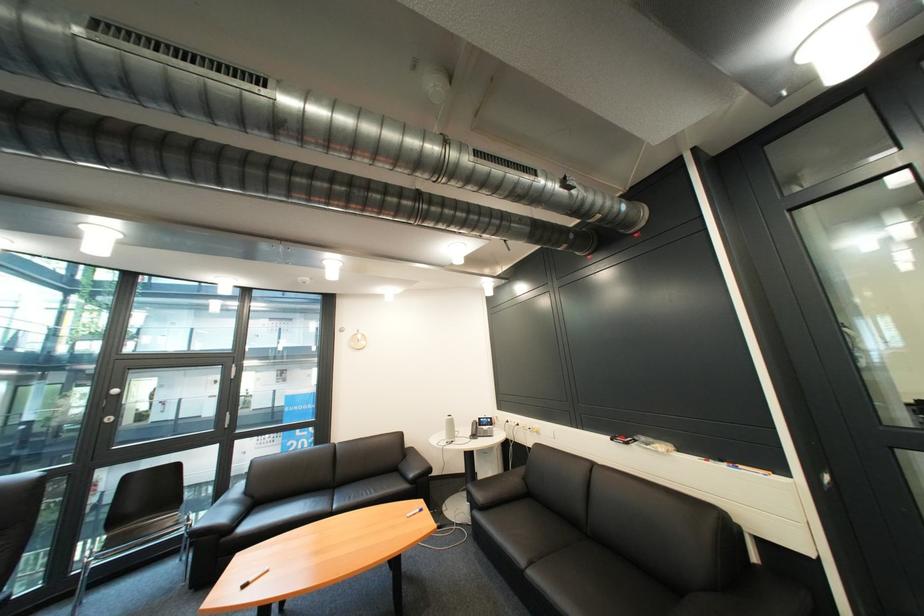
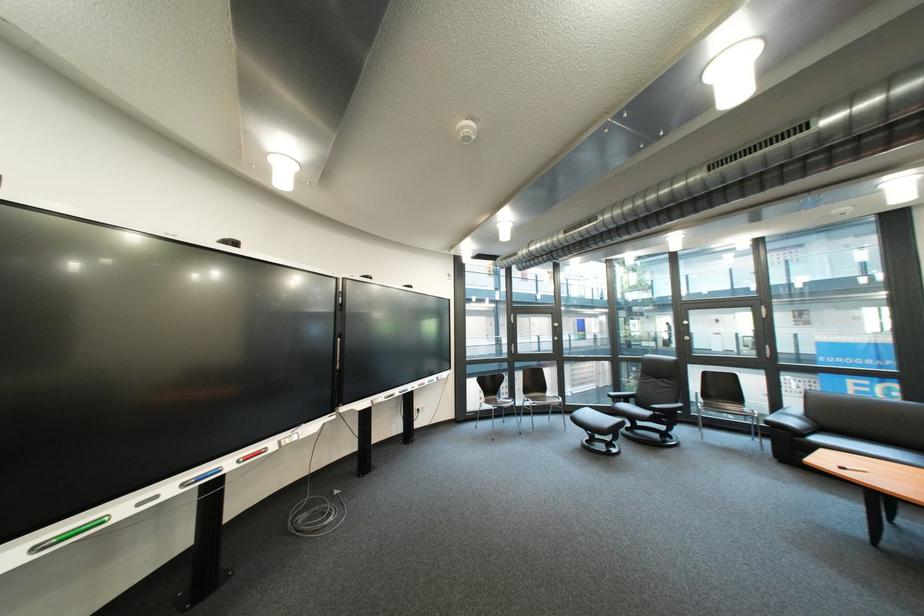
Where in the second image is the point corresponding to the point at 263,582 from the first image?

(862, 469)